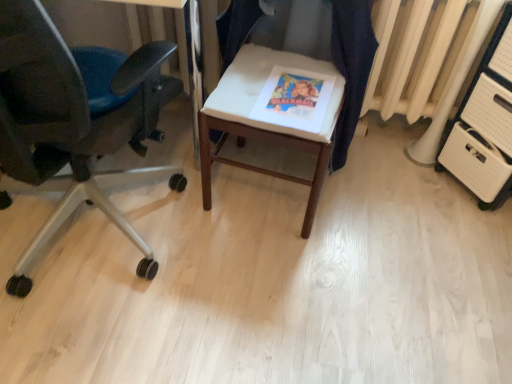
Locate an element on the screen. vacant area that lies to the right of matte black office chair at left, the first chair viewed from the left is located at coordinates (249, 287).